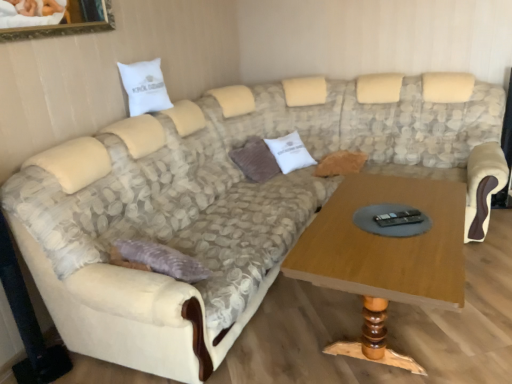
Question: Is white cotton pillow at center, acting as the third pillow starting from the left, at the back of brown corduroy pillow at center, the second pillow viewed from the left?

Choices:
 (A) yes
 (B) no

Answer: (B)

Question: Is white cotton pillow at center, acting as the third pillow starting from the left, a part of brown corduroy pillow at center, the second pillow viewed from the left?

Choices:
 (A) no
 (B) yes

Answer: (A)

Question: Is brown corduroy pillow at center, which is the 2th pillow from right to left, not near white cotton pillow at center, which ranks as the first pillow in right-to-left order?

Choices:
 (A) no
 (B) yes

Answer: (A)

Question: From a real-world perspective, is brown corduroy pillow at center, which is the 2th pillow from right to left, located higher than white cotton pillow at center, acting as the third pillow starting from the left?

Choices:
 (A) no
 (B) yes

Answer: (A)

Question: Considering the relative sizes of brown corduroy pillow at center, which is the 2th pillow from right to left, and white cotton pillow at center, which ranks as the first pillow in right-to-left order, in the image provided, is brown corduroy pillow at center, which is the 2th pillow from right to left, wider than white cotton pillow at center, which ranks as the first pillow in right-to-left order,?

Choices:
 (A) yes
 (B) no

Answer: (B)

Question: Which is correct: white cotton pillow at upper left, marked as the third pillow in a right-to-left arrangement, is inside brown corduroy pillow at center, which is the 2th pillow from right to left, or outside of it?

Choices:
 (A) outside
 (B) inside

Answer: (A)

Question: From a real-world perspective, relative to brown corduroy pillow at center, the second pillow viewed from the left, is white cotton pillow at upper left, the 1th pillow in the left-to-right sequence, vertically above or below?

Choices:
 (A) above
 (B) below

Answer: (A)

Question: Is white cotton pillow at upper left, the 1th pillow in the left-to-right sequence, taller or shorter than brown corduroy pillow at center, which is the 2th pillow from right to left?

Choices:
 (A) tall
 (B) short

Answer: (B)

Question: From the image's perspective, is white cotton pillow at upper left, the 1th pillow in the left-to-right sequence, located above or below brown corduroy pillow at center, which is the 2th pillow from right to left?

Choices:
 (A) below
 (B) above

Answer: (B)

Question: Is white cotton pillow at upper left, marked as the third pillow in a right-to-left arrangement, inside or outside of white cotton pillow at center, acting as the third pillow starting from the left?

Choices:
 (A) inside
 (B) outside

Answer: (B)

Question: From the image's perspective, is white cotton pillow at upper left, the 1th pillow in the left-to-right sequence, above or below white cotton pillow at center, which ranks as the first pillow in right-to-left order?

Choices:
 (A) below
 (B) above

Answer: (B)

Question: Is white cotton pillow at upper left, marked as the third pillow in a right-to-left arrangement, in front of or behind white cotton pillow at center, acting as the third pillow starting from the left, in the image?

Choices:
 (A) behind
 (B) front

Answer: (B)

Question: In terms of height, does white cotton pillow at upper left, the 1th pillow in the left-to-right sequence, look taller or shorter compared to white cotton pillow at center, acting as the third pillow starting from the left?

Choices:
 (A) tall
 (B) short

Answer: (B)

Question: Considering the positions of point (274, 145) and point (269, 158), is point (274, 145) closer or farther from the camera than point (269, 158)?

Choices:
 (A) closer
 (B) farther

Answer: (B)

Question: From a real-world perspective, is white cotton pillow at center, acting as the third pillow starting from the left, positioned above or below brown corduroy pillow at center, the second pillow viewed from the left?

Choices:
 (A) below
 (B) above

Answer: (B)